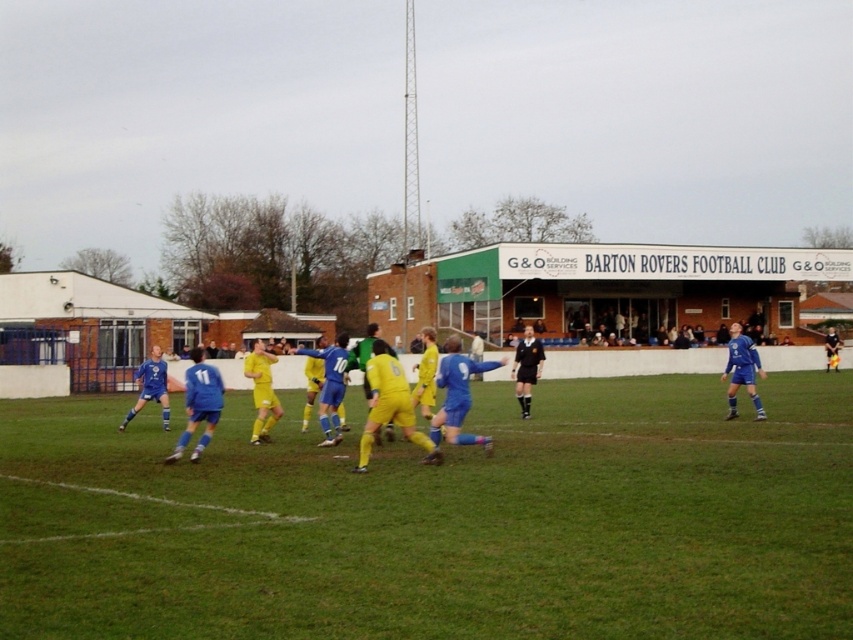
You are a photographer standing at the edge of the soccer field. You want to take a picture that includes both the green grass field at center and the yellow matte soccer players at center. Which object will appear larger in the photo?

The yellow matte soccer players at center will appear larger in the photo because they are taller than the green grass field at center.

You are a photographer at the soccer match. You want to take a photo that includes both the yellow matte soccer players at center and the black smooth shirt at center. Which object should you focus on to ensure both are in clear view?

Since the yellow matte soccer players at center are closer to the viewer than the black smooth shirt at center, you should focus on the yellow matte soccer players at center to ensure both are in clear view.

You are a photographer trying to capture a clear shot of both the yellow matte soccer players at center and the black smooth shirt at center. Which object should you focus on first to ensure it appears larger in your photo?

The yellow matte soccer players at center is taller than the black smooth shirt at center, so you should focus on the yellow matte soccer players at center first to ensure it appears larger in your photo.